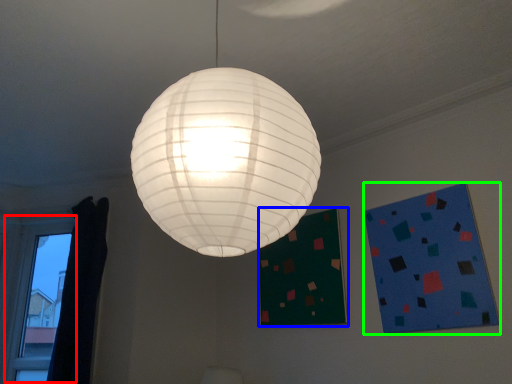
Question: Based on their relative distances, which object is nearer to window (highlighted by a red box)? Choose from bulletin board (highlighted by a blue box) and design (highlighted by a green box).

Choices:
 (A) bulletin board
 (B) design

Answer: (A)